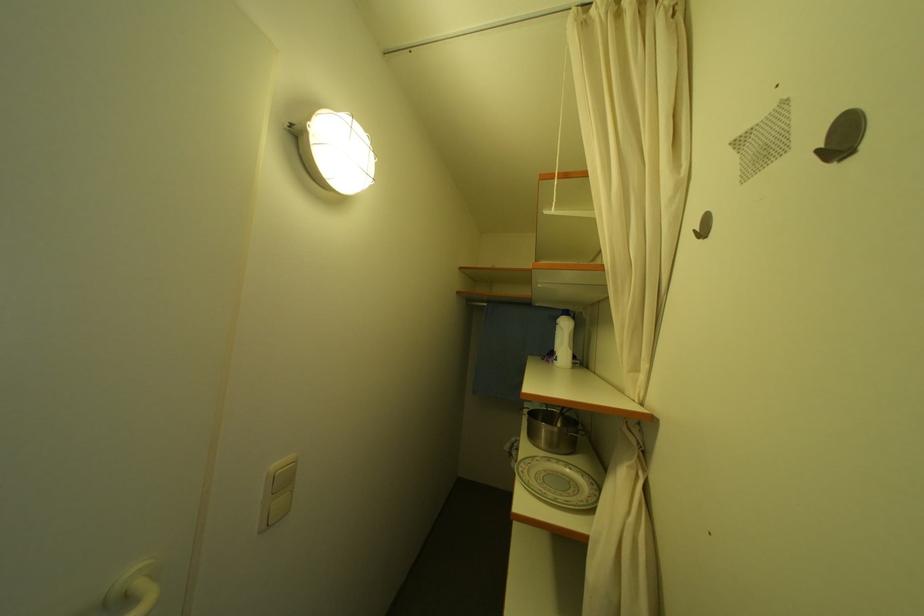
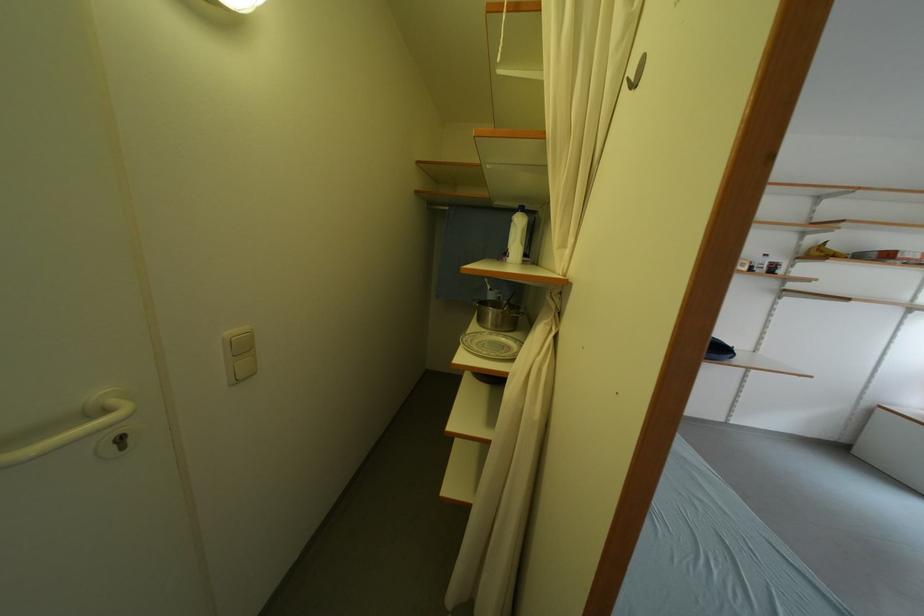
What movement of the cameraman would produce the second image?

The movement direction of the cameraman is right, backward.